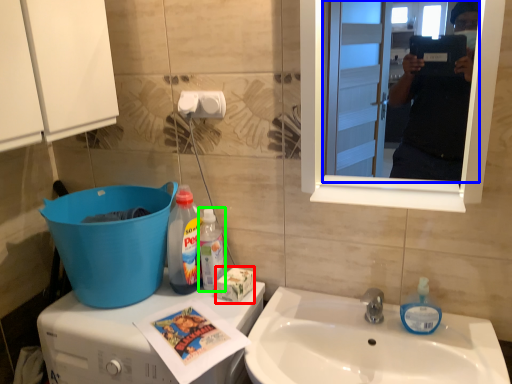
Question: Which is nearer to the box (highlighted by a red box)? mirror (highlighted by a blue box) or bottle (highlighted by a green box).

Choices:
 (A) mirror
 (B) bottle

Answer: (B)